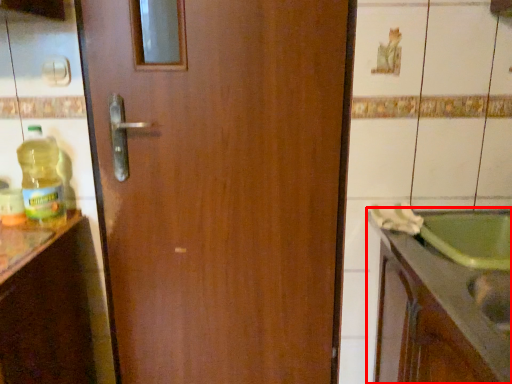
Question: From the image's perspective, what is the correct spatial relationship of countertop (annotated by the red box) in relation to bottle?

Choices:
 (A) below
 (B) above

Answer: (A)